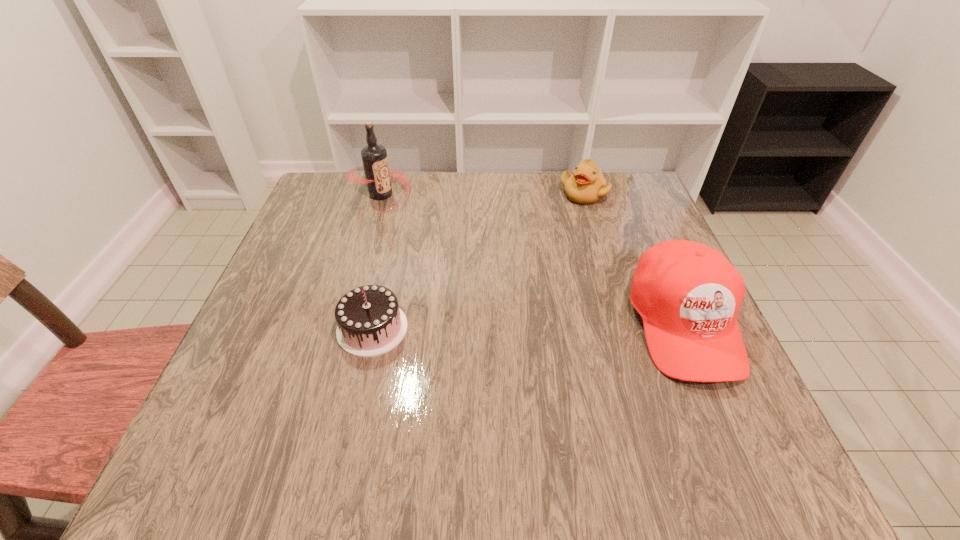
I want to click on free space that satisfies the following two spatial constraints: 1. on the front side of the chocolate cake; 2. on the left side of the tallest object, so click(x=342, y=328).